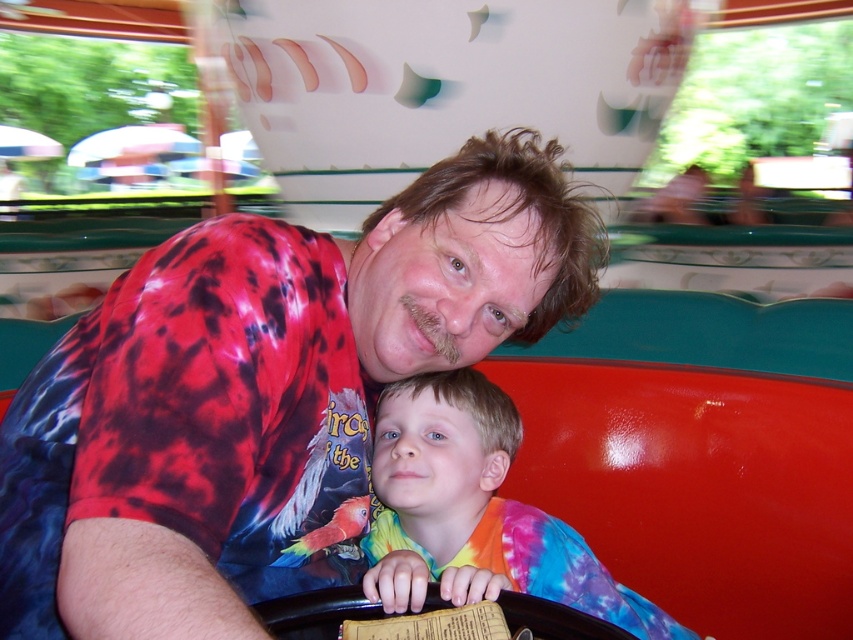
Question: Does tie-dye shirt at center appear on the left side of tie-dye fabric at center?

Choices:
 (A) yes
 (B) no

Answer: (A)

Question: Does tie-dye shirt at center have a larger size compared to tie-dye fabric at center?

Choices:
 (A) no
 (B) yes

Answer: (B)

Question: Which point is farther to the camera?

Choices:
 (A) tie-dye fabric at center
 (B) tie-dye shirt at center

Answer: (A)

Question: Is tie-dye shirt at center below tie-dye fabric at center?

Choices:
 (A) no
 (B) yes

Answer: (A)

Question: Among these objects, which one is farthest from the camera?

Choices:
 (A) tie-dye fabric at center
 (B) tie-dye shirt at center

Answer: (A)